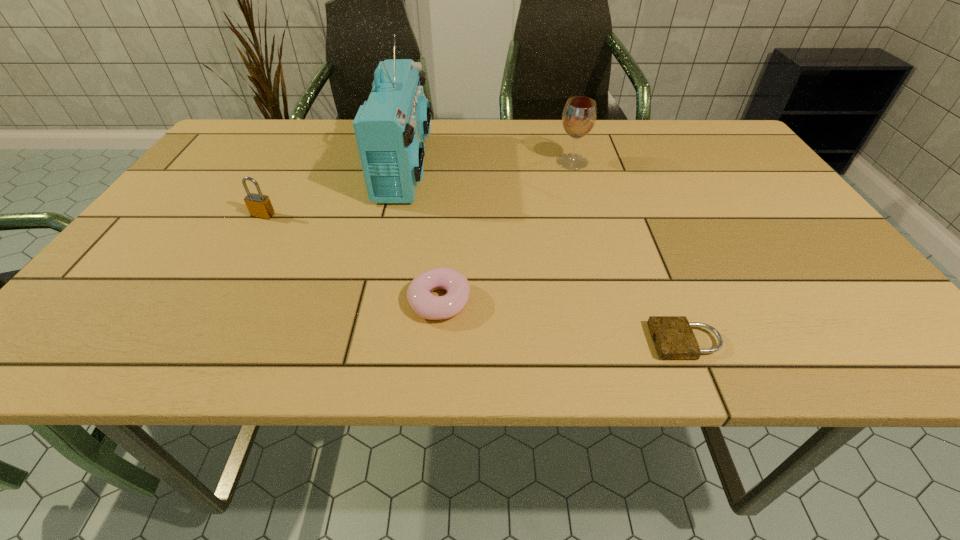
Locate an element on the screen. Image resolution: width=960 pixels, height=540 pixels. vacant space at the near edge of the desktop is located at coordinates (758, 321).

In the image, there is a desktop. Identify the location of vacant space at the left edge. (229, 171).

Where is `vacant point at the right edge`? vacant point at the right edge is located at coordinates tap(786, 256).

The height and width of the screenshot is (540, 960). I want to click on free space at the far left corner of the desktop, so click(x=211, y=153).

This screenshot has width=960, height=540. Identify the location of vacant position at the near left corner of the desktop. (49, 350).

This screenshot has height=540, width=960. In the image, there is a desktop. What are the coordinates of `vacant space at the far right corner` in the screenshot? It's located at (671, 126).

In the image, there is a desktop. At what (x,y) coordinates should I click in order to perform the action: click on vacant space at the near right corner. Please return your answer as a coordinate pair (x, y). Looking at the image, I should click on (856, 360).

Where is `blank region between the tallest object and the wineglass`? blank region between the tallest object and the wineglass is located at coordinates (489, 164).

This screenshot has height=540, width=960. In order to click on free space that is in between the shorter padlock and the wineglass in this screenshot , I will do `click(629, 252)`.

I want to click on vacant space that is in between the tallest object and the shortest object, so click(545, 254).